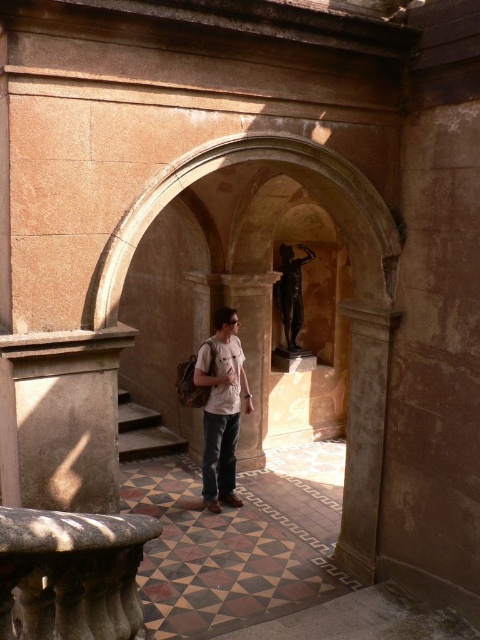
You are a photographer planning to take a picture of the bronze statue at center. However, the white cotton shirt at center is blocking your view. Can you estimate whether the statue is smaller or larger than the obstruction?

The white cotton shirt at center is larger in size than bronze statue at center, so the obstruction is larger than the statue. Therefore, the statue might be fully or partially hidden depending on their positions.

You are an architect visiting the site and want to ensure the bronze statue at center is visible from the entrance. Given that the brown stone pillar at center is in front of it, do you think the statue will be obscured?

The brown stone pillar at center is taller than the bronze statue at center, so the statue may be partially or fully obscured by the pillar depending on their exact positions and angles.

Consider the image. You are a tour guide explaining the historical site to visitors. You point to the white cotton shirt at center and the bronze statue at center. Which one is physically nearer to the visitors standing at the entrance?

The white cotton shirt at center is closer to the visitors because it is nearer to the viewer than the bronze statue at center.